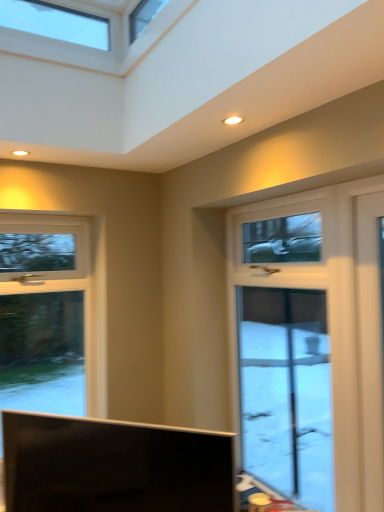
Question: In the image, is white glossy door at right on the left side or the right side of matte black tv at lower center?

Choices:
 (A) right
 (B) left

Answer: (A)

Question: Does point (367, 467) appear closer or farther from the camera than point (29, 440)?

Choices:
 (A) farther
 (B) closer

Answer: (B)

Question: In terms of height, does white glossy door at right look taller or shorter compared to matte black tv at lower center?

Choices:
 (A) short
 (B) tall

Answer: (B)

Question: Is point (160, 441) positioned closer to the camera than point (299, 494)?

Choices:
 (A) farther
 (B) closer

Answer: (B)

Question: Looking at the image, does matte black tv at lower center seem bigger or smaller compared to white glossy door at right?

Choices:
 (A) small
 (B) big

Answer: (B)

Question: Would you say matte black tv at lower center is inside or outside white glossy door at right?

Choices:
 (A) inside
 (B) outside

Answer: (B)

Question: In terms of width, does matte black tv at lower center look wider or thinner when compared to white glossy door at right?

Choices:
 (A) thin
 (B) wide

Answer: (B)